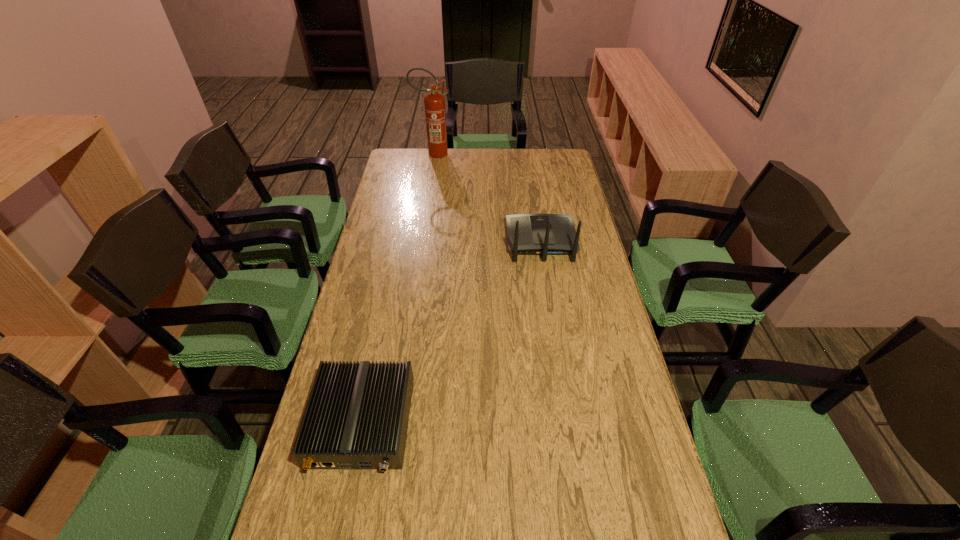
Find the location of a particular element. free point between the nearer router and the farther router is located at coordinates (451, 332).

The height and width of the screenshot is (540, 960). I want to click on free space between the rightmost object and the tallest object, so click(x=487, y=198).

Find the location of `free spot between the second shortest object and the fire extinguisher`. free spot between the second shortest object and the fire extinguisher is located at coordinates (487, 198).

You are a GUI agent. You are given a task and a screenshot of the screen. Output one action in this format:
    pyautogui.click(x=<x>, y=<y>)
    Task: Click on the vacant area between the right router and the farthest object
    Image resolution: width=960 pixels, height=540 pixels.
    Given the screenshot: What is the action you would take?
    pyautogui.click(x=487, y=198)

The width and height of the screenshot is (960, 540). What are the coordinates of `free space that is in between the fire extinguisher and the second farthest object` in the screenshot? It's located at (487, 198).

The image size is (960, 540). I want to click on free point between the right router and the nearer router, so click(451, 332).

Where is `vacant space that's between the farther router and the tallest object`? This screenshot has height=540, width=960. vacant space that's between the farther router and the tallest object is located at coordinates (487, 198).

Locate an element on the screen. vacant point located between the tallest object and the farther router is located at coordinates (487, 198).

This screenshot has width=960, height=540. I want to click on free space between the farthest object and the nearest object, so click(x=397, y=288).

Select which object is the closest to the shorter router. Please provide its 2D coordinates. Your answer should be formatted as a tuple, i.e. [(x, y)], where the tuple contains the x and y coordinates of a point satisfying the conditions above.

[(528, 234)]